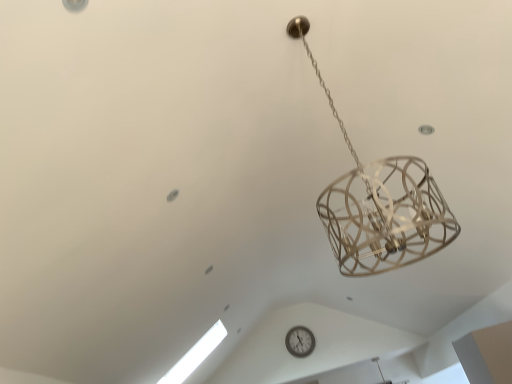
Locate an element on the screen. transparent glass window at lower left is located at coordinates (195, 355).

In order to face transparent glass window at lower left, should I rotate leftwards or rightwards?

Rotate your view left by about 9.486°.

Describe the element at coordinates (195, 355) in the screenshot. The image size is (512, 384). I see `transparent glass window at lower left` at that location.

The image size is (512, 384). Describe the element at coordinates (300, 341) in the screenshot. I see `white plastic wall clock at center` at that location.

At what (x,y) coordinates should I click in order to perform the action: click on white plastic wall clock at center. Please return your answer as a coordinate pair (x, y). This screenshot has width=512, height=384. Looking at the image, I should click on (300, 341).

Locate an element on the screen. transparent glass window at lower left is located at coordinates (195, 355).

Considering the relative positions of white plastic wall clock at center and transparent glass window at lower left in the image provided, is white plastic wall clock at center to the left or to the right of transparent glass window at lower left?

white plastic wall clock at center is positioned on transparent glass window at lower left's right side.

Which is in front, white plastic wall clock at center or transparent glass window at lower left?

transparent glass window at lower left is closer to the camera.

Between point (312, 338) and point (184, 368), which one is positioned in front?

The point (184, 368) is in front.

From the image's perspective, is white plastic wall clock at center beneath transparent glass window at lower left?

Yes, from the image's perspective, white plastic wall clock at center is beneath transparent glass window at lower left.

Looking at this image, from a real-world perspective, who is located lower, white plastic wall clock at center or transparent glass window at lower left?

transparent glass window at lower left is physically lower.

Which of these two, white plastic wall clock at center or transparent glass window at lower left, is thinner?

white plastic wall clock at center is thinner.

Does white plastic wall clock at center have a greater height compared to transparent glass window at lower left?

No, white plastic wall clock at center is not taller than transparent glass window at lower left.

In terms of size, does white plastic wall clock at center appear bigger or smaller than transparent glass window at lower left?

white plastic wall clock at center is smaller than transparent glass window at lower left.

Is white plastic wall clock at center outside of transparent glass window at lower left?

Absolutely, white plastic wall clock at center is external to transparent glass window at lower left.

Can you see white plastic wall clock at center touching transparent glass window at lower left?

No, white plastic wall clock at center is not beside transparent glass window at lower left.

Is white plastic wall clock at center turned away from transparent glass window at lower left?

No, white plastic wall clock at center is not facing the opposite direction of transparent glass window at lower left.

The height and width of the screenshot is (384, 512). What are the coordinates of `window that is in front of the white plastic wall clock at center` in the screenshot? It's located at (195, 355).

From the picture: Considering the positions of objects transparent glass window at lower left and white plastic wall clock at center in the image provided, who is more to the right, transparent glass window at lower left or white plastic wall clock at center?

From the viewer's perspective, white plastic wall clock at center appears more on the right side.

Considering the positions of objects transparent glass window at lower left and white plastic wall clock at center in the image provided, who is behind, transparent glass window at lower left or white plastic wall clock at center?

Positioned behind is white plastic wall clock at center.

Which is in front, point (200, 354) or point (294, 345)?

The point (200, 354) is closer.

From the image's perspective, is transparent glass window at lower left over white plastic wall clock at center?

Indeed, from the image's perspective, transparent glass window at lower left is shown above white plastic wall clock at center.

From a real-world perspective, which is physically below, transparent glass window at lower left or white plastic wall clock at center?

From a 3D spatial view, transparent glass window at lower left is below.

Which object is wider, transparent glass window at lower left or white plastic wall clock at center?

transparent glass window at lower left is wider.

Is transparent glass window at lower left taller than white plastic wall clock at center?

Yes.

Who is bigger, transparent glass window at lower left or white plastic wall clock at center?

transparent glass window at lower left is bigger.

In the scene shown: Could white plastic wall clock at center be considered to be inside transparent glass window at lower left?

No.

Is transparent glass window at lower left not near white plastic wall clock at center?

Yes, transparent glass window at lower left is far from white plastic wall clock at center.

Looking at this image, is transparent glass window at lower left turned away from white plastic wall clock at center?

No.

This screenshot has height=384, width=512. Find the location of `window above the white plastic wall clock at center (from the image's perspective)`. window above the white plastic wall clock at center (from the image's perspective) is located at coordinates (195, 355).

Locate an element on the screen. Image resolution: width=512 pixels, height=384 pixels. window that is on the left side of white plastic wall clock at center is located at coordinates (195, 355).

The height and width of the screenshot is (384, 512). Identify the location of window above the white plastic wall clock at center (from the image's perspective). (195, 355).